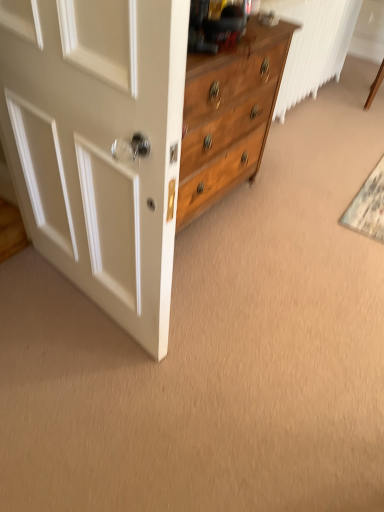
Question: Relative to textured gray doormat at lower right, is white glossy door at left in front or behind?

Choices:
 (A) front
 (B) behind

Answer: (A)

Question: From the image's perspective, is white glossy door at left located above or below textured gray doormat at lower right?

Choices:
 (A) below
 (B) above

Answer: (A)

Question: Is white glossy door at left to the left or to the right of textured gray doormat at lower right in the image?

Choices:
 (A) left
 (B) right

Answer: (A)

Question: Is textured gray doormat at lower right to the left or to the right of white glossy door at left in the image?

Choices:
 (A) right
 (B) left

Answer: (A)

Question: From the image's perspective, relative to white glossy door at left, is textured gray doormat at lower right above or below?

Choices:
 (A) above
 (B) below

Answer: (A)

Question: Is textured gray doormat at lower right wider or thinner than white glossy door at left?

Choices:
 (A) wide
 (B) thin

Answer: (A)

Question: Do you think textured gray doormat at lower right is within white glossy door at left, or outside of it?

Choices:
 (A) outside
 (B) inside

Answer: (A)